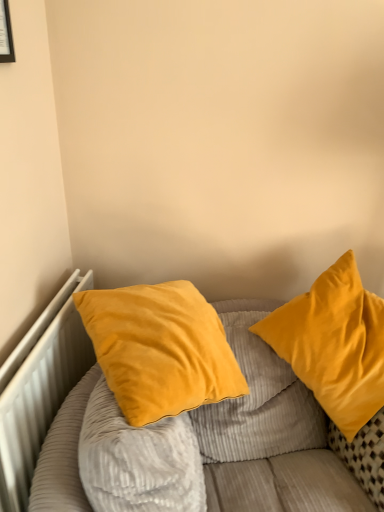
This screenshot has width=384, height=512. Identify the location of velvet yellow pillows at upper right. (276, 455).

I want to click on velvet yellow pillow at center, which appears as the second pillow when viewed from the right, so click(x=138, y=460).

Measure the distance between matte black picture frame at upper left and camera.

matte black picture frame at upper left and camera are 3.59 feet apart from each other.

Describe the element at coordinates (6, 34) in the screenshot. The height and width of the screenshot is (512, 384). I see `matte black picture frame at upper left` at that location.

Where is `velvet yellow pillows at upper right`? The height and width of the screenshot is (512, 384). velvet yellow pillows at upper right is located at coordinates (276, 455).

From the image's perspective, who appears lower, white metallic radiator at left or velvet yellow pillow at right, which appears as the first pillow when viewed from the right?

white metallic radiator at left appears lower in the image.

Relative to velvet yellow pillow at right, the 2th pillow positioned from the left, is white metallic radiator at left in front or behind?

In the image, white metallic radiator at left appears in front of velvet yellow pillow at right, the 2th pillow positioned from the left.

Can you confirm if white metallic radiator at left is positioned to the left of velvet yellow pillow at right, which appears as the first pillow when viewed from the right?

Yes.

Could velvet yellow pillow at right, the 2th pillow positioned from the left, be considered to be inside white metallic radiator at left?

No, white metallic radiator at left does not contain velvet yellow pillow at right, the 2th pillow positioned from the left.

You are a GUI agent. You are given a task and a screenshot of the screen. Output one action in this format:
    pyautogui.click(x=<x>, y=<y>)
    Task: Click on the picture frame above the velvet yellow pillow at right, the 2th pillow positioned from the left (from the image's perspective)
    This screenshot has width=384, height=512.
    Given the screenshot: What is the action you would take?
    pyautogui.click(x=6, y=34)

Is matte black picture frame at upper left inside velvet yellow pillow at right, the 2th pillow positioned from the left?

Definitely not — matte black picture frame at upper left is not inside velvet yellow pillow at right, the 2th pillow positioned from the left.

From the image's perspective, which one is positioned lower, velvet yellow pillow at right, the 2th pillow positioned from the left, or matte black picture frame at upper left?

velvet yellow pillow at right, the 2th pillow positioned from the left, is shown below in the image.

Is white metallic radiator at left thinner than velvet yellow pillow at center, the 1th pillow in the left-to-right sequence?

Yes, white metallic radiator at left is thinner than velvet yellow pillow at center, the 1th pillow in the left-to-right sequence.

From a real-world perspective, does white metallic radiator at left sit lower than velvet yellow pillow at center, which appears as the second pillow when viewed from the right?

Yes, from a real-world perspective, white metallic radiator at left is below velvet yellow pillow at center, which appears as the second pillow when viewed from the right.

Based on their sizes in the image, would you say white metallic radiator at left is bigger or smaller than velvet yellow pillow at center, the 1th pillow in the left-to-right sequence?

Clearly, white metallic radiator at left is smaller in size than velvet yellow pillow at center, the 1th pillow in the left-to-right sequence.

Is white metallic radiator at left not inside matte black picture frame at upper left?

white metallic radiator at left lies outside matte black picture frame at upper left's area.

Is white metallic radiator at left next to matte black picture frame at upper left and touching it?

No, white metallic radiator at left is not beside matte black picture frame at upper left.

In terms of width, does white metallic radiator at left look wider or thinner when compared to matte black picture frame at upper left?

white metallic radiator at left is wider than matte black picture frame at upper left.

Is white metallic radiator at left positioned with its back to matte black picture frame at upper left?

No, matte black picture frame at upper left is not at the back of white metallic radiator at left.

Can you confirm if velvet yellow pillow at center, which appears as the second pillow when viewed from the right, is smaller than velvet yellow pillows at upper right?

Correct, velvet yellow pillow at center, which appears as the second pillow when viewed from the right, occupies less space than velvet yellow pillows at upper right.

From a real-world perspective, who is located higher, velvet yellow pillow at center, the 1th pillow in the left-to-right sequence, or velvet yellow pillows at upper right?

velvet yellow pillow at center, the 1th pillow in the left-to-right sequence.

Considering the positions of objects velvet yellow pillow at center, the 1th pillow in the left-to-right sequence, and velvet yellow pillows at upper right in the image provided, who is behind, velvet yellow pillow at center, the 1th pillow in the left-to-right sequence, or velvet yellow pillows at upper right?

velvet yellow pillow at center, the 1th pillow in the left-to-right sequence, is further away from the camera.

Is matte black picture frame at upper left oriented towards velvet yellow pillow at center, the 1th pillow in the left-to-right sequence?

No, matte black picture frame at upper left does not turn towards velvet yellow pillow at center, the 1th pillow in the left-to-right sequence.

How different are the orientations of matte black picture frame at upper left and velvet yellow pillow at center, the 1th pillow in the left-to-right sequence, in degrees?

11.6 degrees.

Does point (2, 46) come closer to viewer compared to point (172, 432)?

Yes, it is in front of point (172, 432).

From a real-world perspective, between matte black picture frame at upper left and velvet yellow pillow at center, which appears as the second pillow when viewed from the right, who is vertically higher?

matte black picture frame at upper left, from a real-world perspective.

From a real-world perspective, is velvet yellow pillow at center, the 1th pillow in the left-to-right sequence, above or below white metallic radiator at left?

In terms of real-world spatial position, velvet yellow pillow at center, the 1th pillow in the left-to-right sequence, is above white metallic radiator at left.

Which object is wider, velvet yellow pillow at center, which appears as the second pillow when viewed from the right, or white metallic radiator at left?

With larger width is velvet yellow pillow at center, which appears as the second pillow when viewed from the right.

From the image's perspective, between velvet yellow pillow at center, which appears as the second pillow when viewed from the right, and white metallic radiator at left, who is located below?

velvet yellow pillow at center, which appears as the second pillow when viewed from the right, from the image's perspective.

This screenshot has height=512, width=384. Identify the location of radiator located in front of the velvet yellow pillow at right, which appears as the first pillow when viewed from the right. (39, 388).

The height and width of the screenshot is (512, 384). I want to click on pillow that is the 2nd object located behind the matte black picture frame at upper left, so (x=334, y=344).

Which object lies further to the anchor point matte black picture frame at upper left, velvet yellow pillows at upper right or velvet yellow pillow at center, which appears as the second pillow when viewed from the right?

Based on the image, velvet yellow pillows at upper right appears to be further to matte black picture frame at upper left.

From the picture: Which object lies further to the anchor point white metallic radiator at left, matte black picture frame at upper left or velvet yellow pillow at center, the 1th pillow in the left-to-right sequence?

matte black picture frame at upper left is further to white metallic radiator at left.

Based on their spatial positions, is matte black picture frame at upper left or velvet yellow pillow at right, the 2th pillow positioned from the left, further from white metallic radiator at left?

Based on the image, matte black picture frame at upper left appears to be further to white metallic radiator at left.

Which object lies further to the anchor point velvet yellow pillow at right, which appears as the first pillow when viewed from the right, white metallic radiator at left or matte black picture frame at upper left?

matte black picture frame at upper left is further to velvet yellow pillow at right, which appears as the first pillow when viewed from the right.

Which object lies nearer to the anchor point velvet yellow pillows at upper right, matte black picture frame at upper left or white metallic radiator at left?

white metallic radiator at left is closer to velvet yellow pillows at upper right.

Which object lies nearer to the anchor point velvet yellow pillow at right, the 2th pillow positioned from the left, matte black picture frame at upper left or velvet yellow pillow at center, which appears as the second pillow when viewed from the right?

velvet yellow pillow at center, which appears as the second pillow when viewed from the right.

From the image, which object appears to be nearer to velvet yellow pillow at center, the 1th pillow in the left-to-right sequence, velvet yellow pillow at right, the 2th pillow positioned from the left, or white metallic radiator at left?

Based on the image, white metallic radiator at left appears to be nearer to velvet yellow pillow at center, the 1th pillow in the left-to-right sequence.

Based on their spatial positions, is velvet yellow pillow at center, the 1th pillow in the left-to-right sequence, or velvet yellow pillows at upper right closer to white metallic radiator at left?

velvet yellow pillow at center, the 1th pillow in the left-to-right sequence, lies closer to white metallic radiator at left than the other object.

What are the coordinates of `pillow between white metallic radiator at left and velvet yellow pillow at right, the 2th pillow positioned from the left` in the screenshot? It's located at (138, 460).

You are a GUI agent. You are given a task and a screenshot of the screen. Output one action in this format:
    pyautogui.click(x=<x>, y=<y>)
    Task: Click on the pillow between matte black picture frame at upper left and velvet yellow pillow at center, the 1th pillow in the left-to-right sequence, vertically
    The width and height of the screenshot is (384, 512).
    Given the screenshot: What is the action you would take?
    pyautogui.click(x=334, y=344)

Locate an element on the screen. The width and height of the screenshot is (384, 512). radiator that lies between matte black picture frame at upper left and velvet yellow pillows at upper right from top to bottom is located at coordinates (39, 388).

This screenshot has width=384, height=512. Find the location of `pillow between matte black picture frame at upper left and white metallic radiator at left in the vertical direction`. pillow between matte black picture frame at upper left and white metallic radiator at left in the vertical direction is located at coordinates (334, 344).